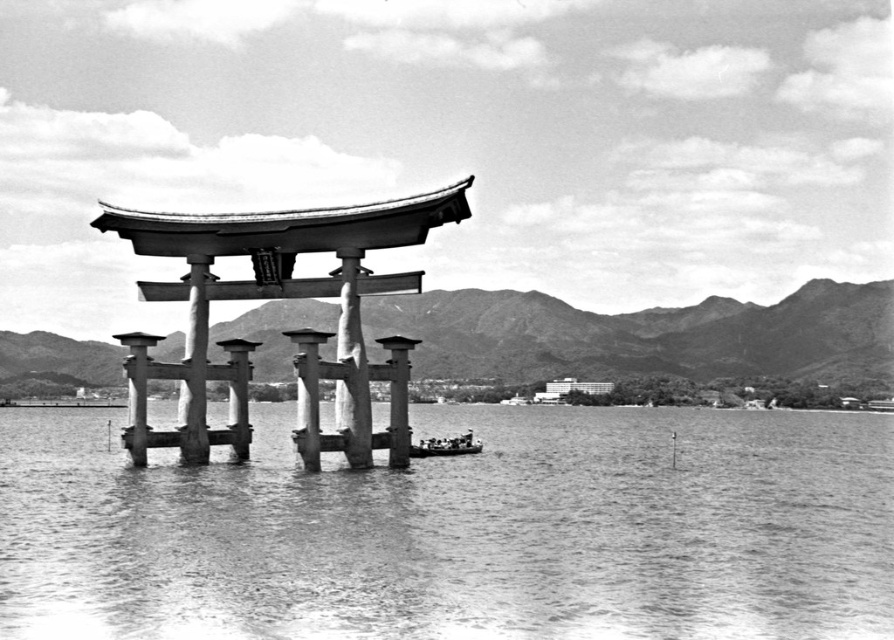
You are a photographer standing at the edge of the water in front of the smooth stone torii gate at center. You want to place your tripod exactly at the point where the torii gate is located. Given that the gate is at point (283, 332), can you confirm if this point is within the water area or on the land near the gate?

The smooth stone torii gate at center is located at point (283, 332). Since the torii gate is partially submerged in water, this point is within the water area.